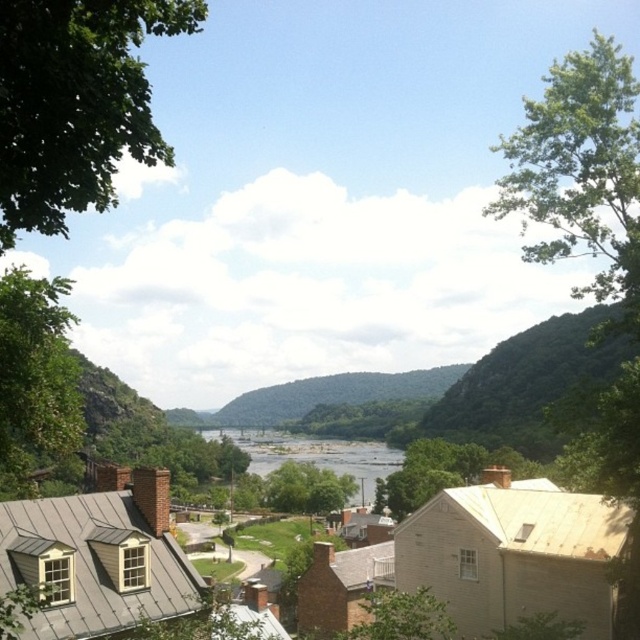
Question: From the image, what is the correct spatial relationship of green leafy tree at upper left in relation to green leafy tree at left?

Choices:
 (A) left
 (B) right

Answer: (A)

Question: Which object is farther from the camera taking this photo?

Choices:
 (A) clear water at center
 (B) green leafy tree at left

Answer: (A)

Question: Which point is farther to the camera?

Choices:
 (A) (502, 144)
 (B) (74, 76)

Answer: (A)

Question: Which object appears farthest from the camera in this image?

Choices:
 (A) green leafy tree at upper left
 (B) green leafy tree at upper right
 (C) clear water at center

Answer: (C)

Question: Is green leafy tree at upper left above green leafy tree at left?

Choices:
 (A) no
 (B) yes

Answer: (B)

Question: Observing the image, what is the correct spatial positioning of green leafy tree at left in reference to clear water at center?

Choices:
 (A) right
 (B) left

Answer: (B)